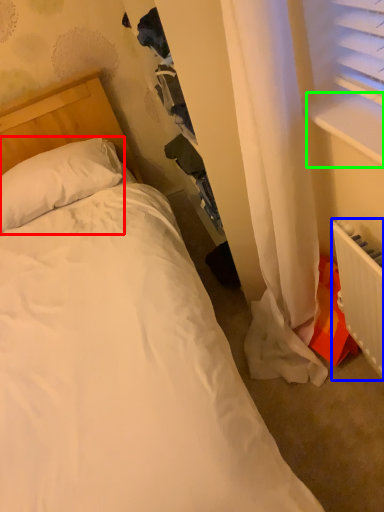
Question: Based on their relative distances, which object is nearer to pillow (highlighted by a red box)? Choose from radiator (highlighted by a blue box) and window sill (highlighted by a green box).

Choices:
 (A) radiator
 (B) window sill

Answer: (B)